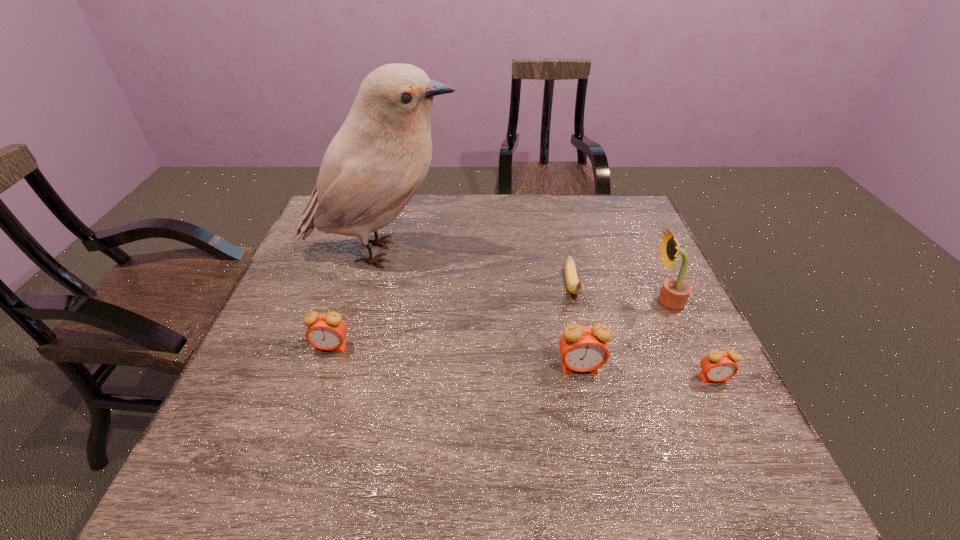
The image size is (960, 540). I want to click on free space between the second tallest object and the farthest alarm clock, so click(498, 325).

Locate an element on the screen. The height and width of the screenshot is (540, 960). vacant region between the sunflower and the banana is located at coordinates (618, 296).

In order to click on unoccupied position between the second alarm clock from right to left and the fourth tallest object in this screenshot , I will do `click(455, 357)`.

The width and height of the screenshot is (960, 540). In order to click on free spot between the second tallest object and the banana in this screenshot , I will do `click(618, 296)`.

I want to click on free spot between the banana and the second tallest alarm clock, so click(452, 318).

At what (x,y) coordinates should I click in order to perform the action: click on empty space between the second shortest alarm clock and the tallest alarm clock. Please return your answer as a coordinate pair (x, y). The image size is (960, 540). Looking at the image, I should click on (455, 357).

Locate an element on the screen. This screenshot has height=540, width=960. vacant region between the third shortest object and the shortest alarm clock is located at coordinates (522, 363).

The width and height of the screenshot is (960, 540). What are the coordinates of `object identified as the closest to the farthest alarm clock` in the screenshot? It's located at (376, 162).

Locate an element on the screen. This screenshot has width=960, height=540. object that is the third closest to the farthest alarm clock is located at coordinates (575, 286).

This screenshot has width=960, height=540. Identify the location of the third closest alarm clock relative to the parakeet. (718, 365).